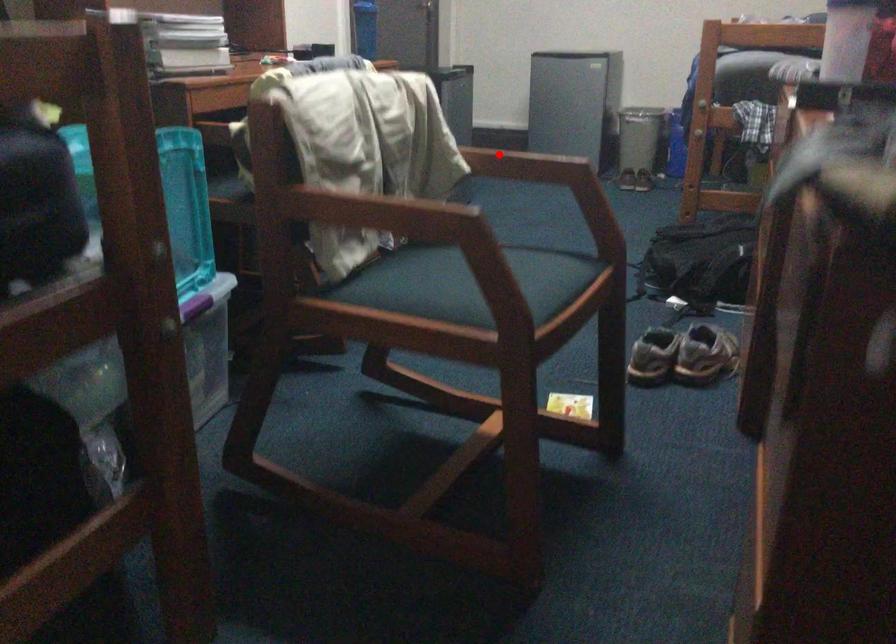
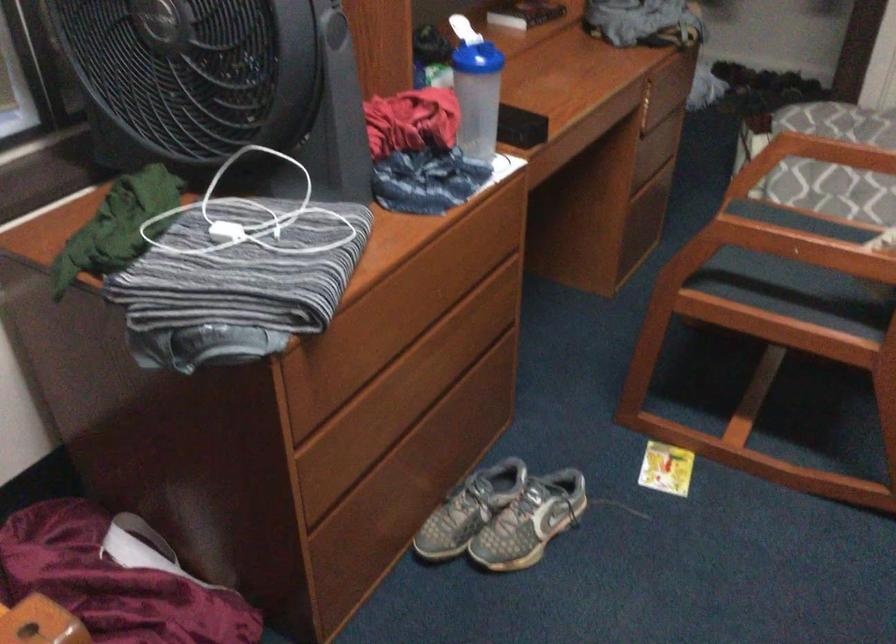
In the second image, find the point that corresponds to the highlighted location in the first image.

(826, 234)